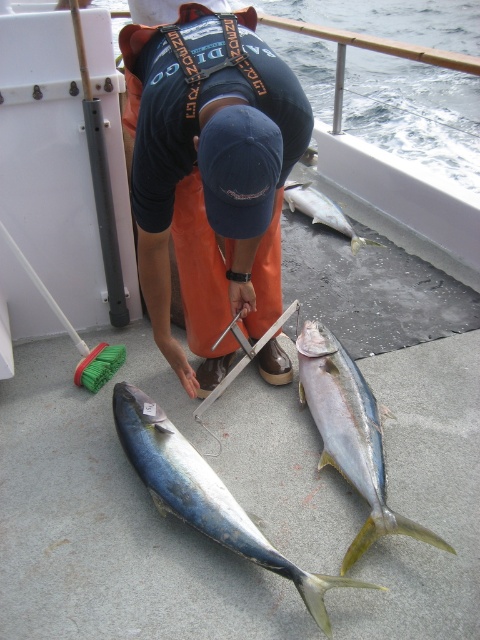
Based on the photo, does orange fabric at center appear under shiny yellow fish at center?

No, orange fabric at center is not below shiny yellow fish at center.

Does orange fabric at center have a greater height compared to shiny yellow fish at center?

Indeed, orange fabric at center has a greater height compared to shiny yellow fish at center.

Between point (214, 61) and point (302, 326), which one is positioned in front?

Point (214, 61)

In order to click on orange fabric at center in this screenshot , I will do `click(210, 173)`.

Based on the photo, is the position of shiny blue fish at center less distant than that of shiny yellow fish at center?

Yes, it is in front of shiny yellow fish at center.

Who is positioned more to the right, shiny blue fish at center or shiny yellow fish at center?

shiny yellow fish at center is more to the right.

Which is behind, point (162, 440) or point (325, 348)?

The point (325, 348) is behind.

Find the location of a particular element. The height and width of the screenshot is (640, 480). shiny blue fish at center is located at coordinates (205, 496).

Which is in front, point (157, 500) or point (349, 224)?

Point (157, 500) is in front.

Is shiny blue fish at center taller than shiny silver fish at center?

Incorrect, shiny blue fish at center's height is not larger of shiny silver fish at center's.

Which is in front, point (204, 524) or point (287, 189)?

Point (204, 524) is in front.

Where is `shiny blue fish at center`? The height and width of the screenshot is (640, 480). shiny blue fish at center is located at coordinates (205, 496).